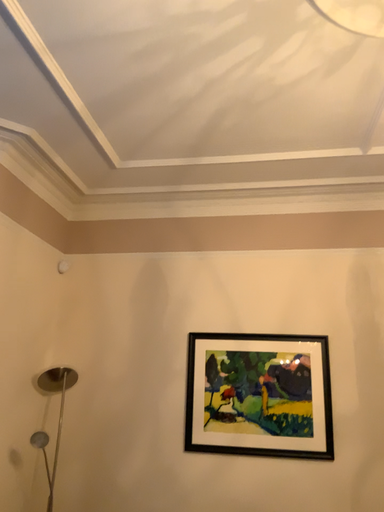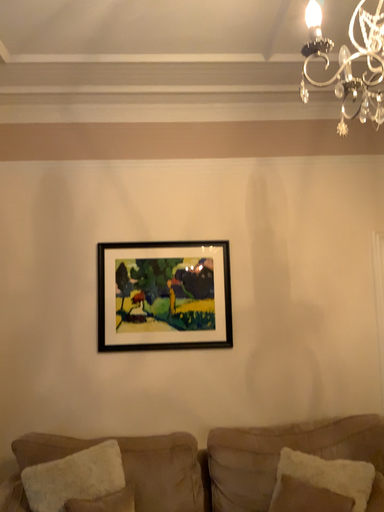
Question: Which way did the camera rotate in the video?

Choices:
 (A) rotated right
 (B) rotated left

Answer: (A)